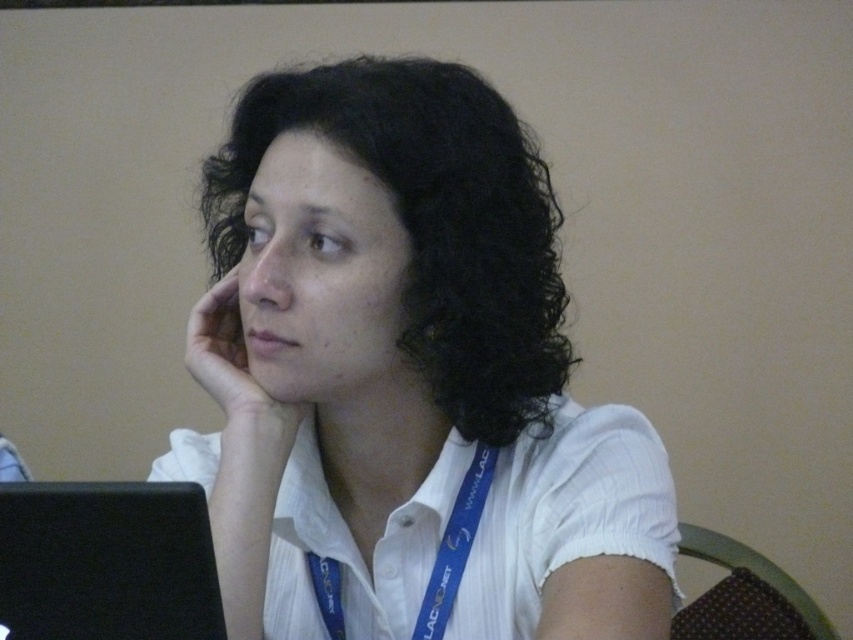
You are a photographer setting up for a portrait session. You notice the blue fabric lanyard at center and the black matte laptop at lower left. To ensure both are visible in the frame, which object should you adjust to avoid blocking the other?

The blue fabric lanyard at center is positioned under the black matte laptop at lower left, so you should adjust the black matte laptop at lower left to move it upwards or sideways to prevent it from blocking the blue fabric lanyard at center.

You are an event photographer who needs to capture a clear photo of the white matte shirt at center and the black matte laptop at lower left. Which object should you focus on first if you want to ensure both are in focus without adjusting the camera settings?

The white matte shirt at center is to the right of the black matte laptop at lower left, so focusing on the black matte laptop at lower left first would help ensure both are in focus since it is closer to the camera.

You are a photographer trying to capture a closeup of the white matte shirt at center and the blue fabric lanyard at center. Which object will appear larger in the photo?

The white matte shirt at center will appear larger in the photo because it is closer to the viewer than the blue fabric lanyard at center.